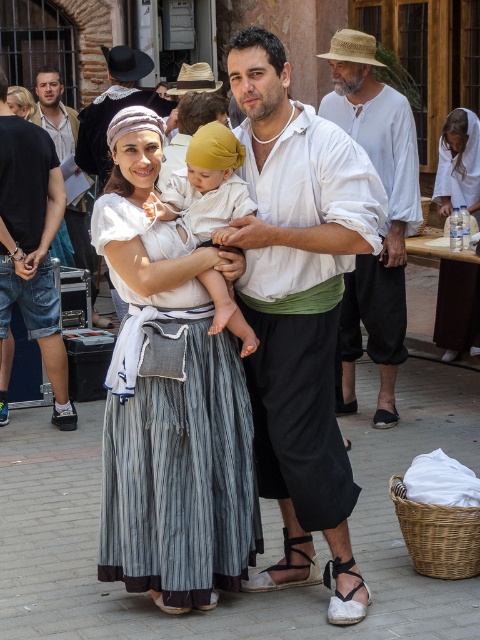
Which is in front, point (279, 385) or point (334, 563)?

Positioned in front is point (279, 385).

Who is lower down, white cotton shirt at center or white fabric sandal at lower center?

white fabric sandal at lower center is lower down.

Identify the location of white cotton shirt at center. The width and height of the screenshot is (480, 640). tap(297, 298).

Between straw hat at center and jeans at left, which one has less height?

jeans at left is shorter.

Measure the distance between point (354,269) and camera.

The distance of point (354,269) from camera is 15.20 feet.

Locate an element on the screen. The width and height of the screenshot is (480, 640). straw hat at center is located at coordinates (386, 216).

Does matte white blouse at center lie in front of white fabric sandal at lower center?

No, it is behind white fabric sandal at lower center.

Does matte white blouse at center come behind white fabric sandal at lower center?

Yes, matte white blouse at center is further from the viewer.

Locate an element on the screen. matte white blouse at center is located at coordinates (168, 400).